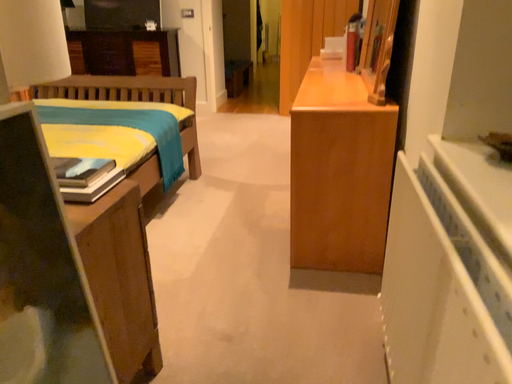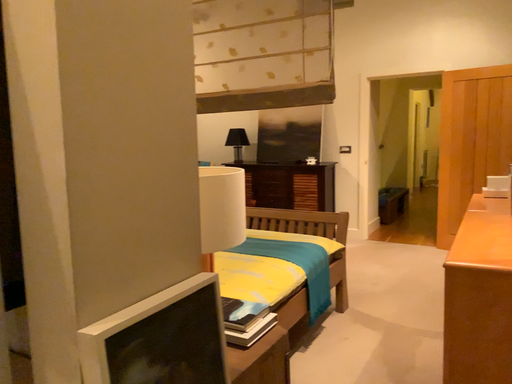
Question: Which way did the camera rotate in the video?

Choices:
 (A) rotated left
 (B) rotated right

Answer: (A)